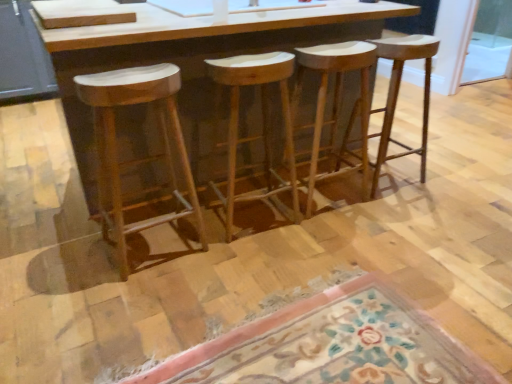
The height and width of the screenshot is (384, 512). In order to click on vacant space that's between natural wood stool at center, which appears as the second stool when viewed from the left, and natural wood stool at center, which ranks as the third stool in left-to-right order in this screenshot , I will do `click(304, 210)`.